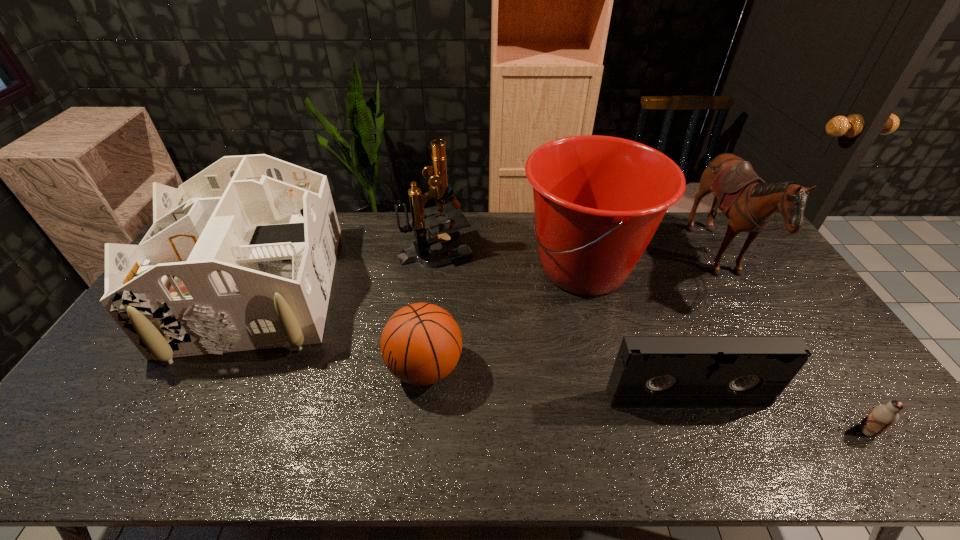
This screenshot has width=960, height=540. I want to click on object positioned at the near right corner, so click(882, 417).

At what (x,y) coordinates should I click in order to perform the action: click on vacant space at the far edge of the desktop. Please return your answer as a coordinate pair (x, y). This screenshot has width=960, height=540. Looking at the image, I should click on (526, 233).

This screenshot has width=960, height=540. In the image, there is a desktop. In order to click on vacant region at the near edge in this screenshot , I will do `click(573, 449)`.

Where is `free space at the left edge`? free space at the left edge is located at coordinates (93, 425).

Where is `blank space at the right edge of the desktop`? blank space at the right edge of the desktop is located at coordinates (791, 296).

Where is `free region at the near right corner`? The image size is (960, 540). free region at the near right corner is located at coordinates (887, 441).

Where is `vacant space that's between the bucket and the microscope`? The image size is (960, 540). vacant space that's between the bucket and the microscope is located at coordinates (510, 259).

At what (x,y) coordinates should I click in order to perform the action: click on vacant region between the chocolate milk and the fourth tallest object. Please return your answer as a coordinate pair (x, y). The height and width of the screenshot is (540, 960). Looking at the image, I should click on (562, 361).

Locate an element on the screen. vacant area that lies between the videotape and the chocolate milk is located at coordinates (777, 415).

I want to click on empty space that is in between the second object from right to left and the videotape, so click(x=703, y=330).